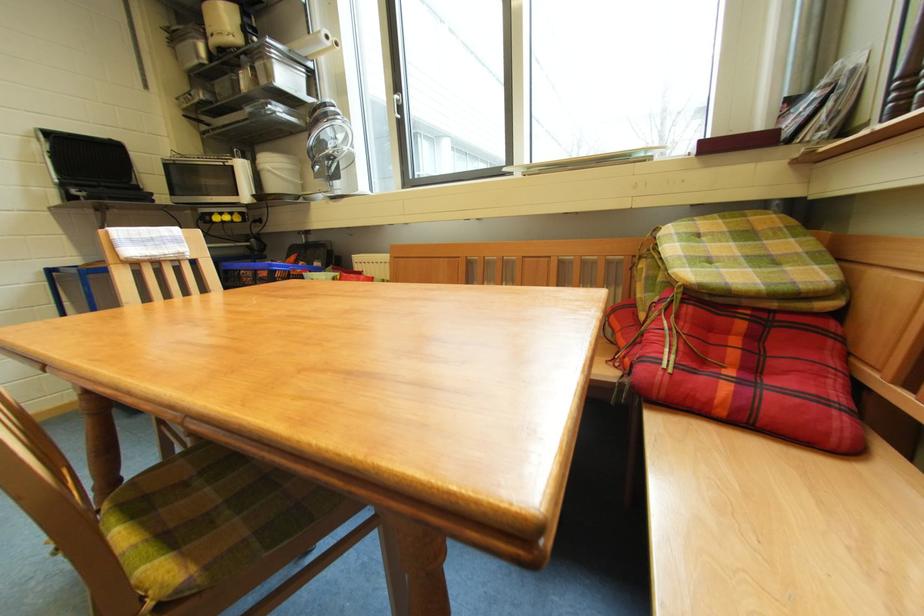
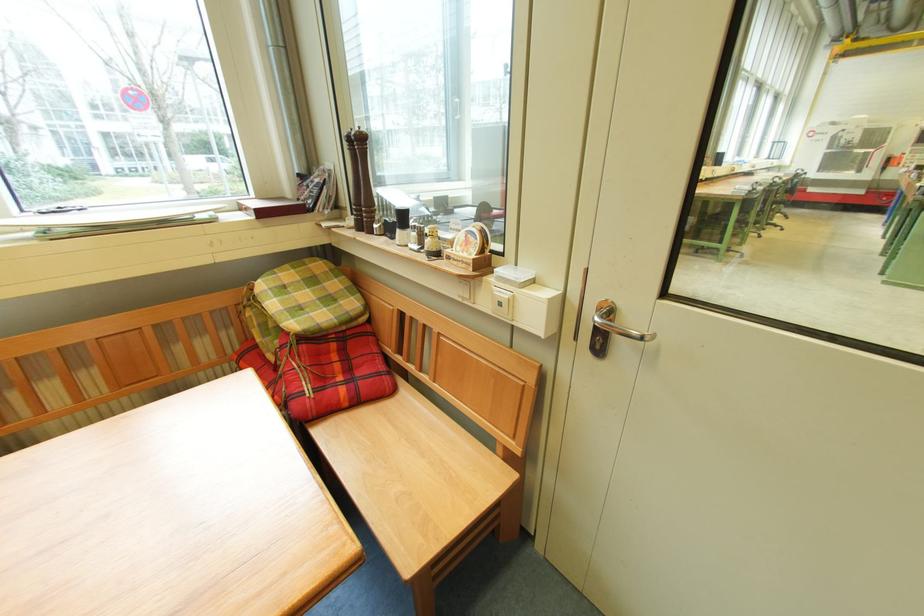
In the second image, find the point that corresponds to pixel 864 463 in the first image.

(403, 397)